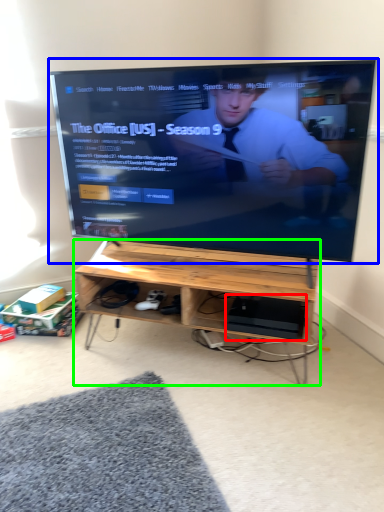
Question: Which object is positioned closest to computer (highlighted by a red box)? Select from television (highlighted by a blue box) and desk (highlighted by a green box).

Choices:
 (A) television
 (B) desk

Answer: (B)